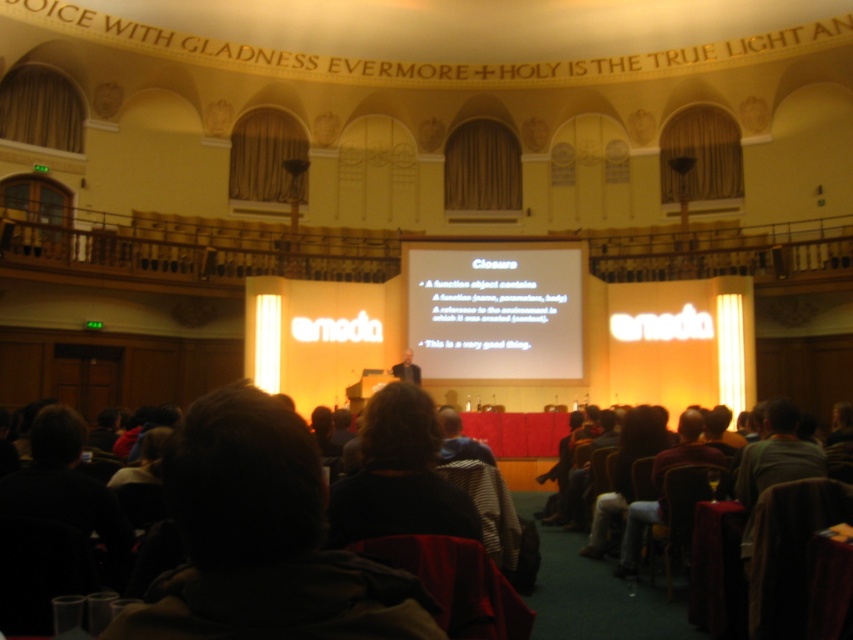
Is white matte projection screen at center shorter than matte black suit at center?

Incorrect, white matte projection screen at center's height does not fall short of matte black suit at center's.

Identify the location of white matte projection screen at center. (495, 312).

Locate an element on the screen. This screenshot has height=640, width=853. white matte projection screen at center is located at coordinates tap(495, 312).

Consider the image. Is dark brown hair at center closer to the viewer compared to matte black suit at center?

Yes, it is in front of matte black suit at center.

The image size is (853, 640). What are the coordinates of `dark brown hair at center` in the screenshot? It's located at (263, 540).

Can you confirm if dark brown hair at center is positioned to the left of white matte projection screen at center?

Indeed, dark brown hair at center is positioned on the left side of white matte projection screen at center.

Does dark brown hair at center appear under white matte projection screen at center?

Correct, dark brown hair at center is located below white matte projection screen at center.

Find the location of a particular element. The height and width of the screenshot is (640, 853). dark brown hair at center is located at coordinates (263, 540).

Find the location of a particular element. The image size is (853, 640). dark brown hair at center is located at coordinates pyautogui.click(x=263, y=540).